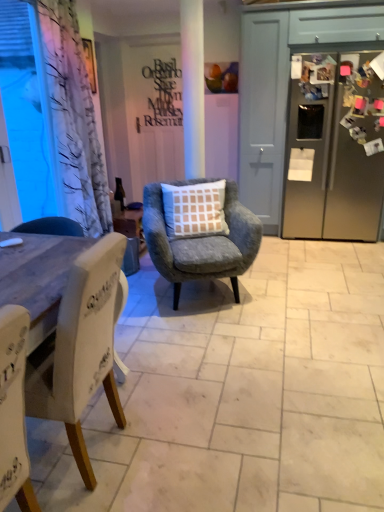
Image resolution: width=384 pixels, height=512 pixels. I want to click on white matte door at center, so click(263, 114).

Locate an element on the screen. The image size is (384, 512). satin silver refrigerator at right is located at coordinates (334, 148).

Describe the element at coordinates (80, 349) in the screenshot. I see `white fabric chair at left, which appears as the first chair when viewed from the left` at that location.

The width and height of the screenshot is (384, 512). Identify the location of matte black writing at center. 164,94.

Consider the image. Between white matte door at center and transparent plastic window screen at left, which one has larger size?

With larger size is white matte door at center.

Does white matte door at center have a lesser width compared to transparent plastic window screen at left?

No.

Can transparent plastic window screen at left be found inside white matte door at center?

Definitely not — transparent plastic window screen at left is not inside white matte door at center.

Is white matte door at center oriented away from transparent plastic window screen at left?

No, white matte door at center is not facing away from transparent plastic window screen at left.

In the scene shown: Is matte black writing at center turned away from satin silver refrigerator at right?

No, matte black writing at center's orientation is not away from satin silver refrigerator at right.

From a real-world perspective, is matte black writing at center positioned under satin silver refrigerator at right based on gravity?

No, from a real-world perspective, matte black writing at center is not below satin silver refrigerator at right.

From the image's perspective, does matte black writing at center appear lower than satin silver refrigerator at right?

No.

Which is less distant, (176, 106) or (345, 151)?

Point (176, 106).

In the scene shown: Relative to matte black writing at center, is matte black bottle at center in front or behind?

matte black bottle at center is in front of matte black writing at center.

Is there a large distance between matte black bottle at center and matte black writing at center?

Yes, matte black bottle at center and matte black writing at center are located far from each other.

This screenshot has width=384, height=512. Identify the location of writing behind the matte black bottle at center. (164, 94).

Which object is positioned more to the right, matte black bottle at center or matte black writing at center?

Positioned to the right is matte black writing at center.

Is matte black bottle at center looking in the opposite direction of transparent plastic window screen at left?

That's not correct — matte black bottle at center is not looking away from transparent plastic window screen at left.

The height and width of the screenshot is (512, 384). I want to click on bottle below the transparent plastic window screen at left (from a real-world perspective), so click(x=119, y=192).

From a real-world perspective, is matte black bottle at center located beneath transparent plastic window screen at left?

Yes, from a real-world perspective, matte black bottle at center is under transparent plastic window screen at left.

Between matte black bottle at center and transparent plastic window screen at left, which one appears on the right side from the viewer's perspective?

Positioned to the right is matte black bottle at center.

Consider the image. From a real-world perspective, relative to white fabric chair at left, which appears as the first chair when viewed from the left, is matte black bottle at center vertically above or below?

matte black bottle at center is above white fabric chair at left, which appears as the first chair when viewed from the left.

Is matte black bottle at center touching white fabric chair at left, the 2th chair positioned from the back?

They are not placed beside each other.

Is matte black bottle at center wider than white fabric chair at left, which appears as the first chair when viewed from the left?

No, matte black bottle at center is not wider than white fabric chair at left, which appears as the first chair when viewed from the left.

You are a GUI agent. You are given a task and a screenshot of the screen. Output one action in this format:
    pyautogui.click(x=<x>, y=<y>)
    Task: Click on the screen door located in front of the matte black bottle at center
    Image resolution: width=384 pixels, height=512 pixels.
    Given the screenshot: What is the action you would take?
    pyautogui.click(x=263, y=114)

Which of these two, white matte door at center or matte black bottle at center, is smaller?

With smaller size is matte black bottle at center.

Considering the positions of objects white matte door at center and matte black bottle at center in the image provided, who is behind, white matte door at center or matte black bottle at center?

Positioned behind is matte black bottle at center.

Which object is positioned more to the right, white matte door at center or matte black bottle at center?

Positioned to the right is white matte door at center.

Considering the positions of points (59, 344) and (24, 157), is point (59, 344) farther from camera compared to point (24, 157)?

No, (59, 344) is closer to viewer.

From a real-world perspective, is white fabric chair at left, which appears as the first chair when viewed from the left, positioned above or below transparent plastic window screen at left?

From a real-world perspective, white fabric chair at left, which appears as the first chair when viewed from the left, is physically below transparent plastic window screen at left.

What's the angular difference between white fabric chair at left, which appears as the first chair when viewed from the left, and transparent plastic window screen at left's facing directions?

179 degrees.

Considering the sizes of objects white fabric chair at left, which ranks as the second chair in right-to-left order, and transparent plastic window screen at left in the image provided, who is thinner, white fabric chair at left, which ranks as the second chair in right-to-left order, or transparent plastic window screen at left?

transparent plastic window screen at left is thinner.

Identify the location of window screen that appears above the white matte door at center (from a real-world perspective). (27, 117).

This screenshot has height=512, width=384. I want to click on writing that appears behind the satin silver refrigerator at right, so click(x=164, y=94).

Looking at the image, which one is located further to white matte door at center, matte black writing at center or satin silver refrigerator at right?

matte black writing at center lies further to white matte door at center than the other object.

Which object lies nearer to the anchor point velvet grey armchair with checkered cushion at center, which ranks as the 2th chair in front-to-back order, satin silver refrigerator at right or matte black writing at center?

satin silver refrigerator at right.

Which object lies nearer to the anchor point matte black writing at center, velvet grey armchair with checkered cushion at center, which ranks as the 2th chair in front-to-back order, or white matte door at center?

white matte door at center is closer to matte black writing at center.

Estimate the real-world distances between objects in this image. Which object is closer to white matte door at center, matte black bottle at center or transparent plastic window screen at left?

Based on the image, matte black bottle at center appears to be nearer to white matte door at center.

Based on their spatial positions, is velvet grey armchair with checkered cushion at center, the second chair in the left-to-right sequence, or matte black bottle at center closer to white matte door at center?

velvet grey armchair with checkered cushion at center, the second chair in the left-to-right sequence.

Which object lies nearer to the anchor point satin silver refrigerator at right, matte black writing at center or white matte door at center?

Among the two, white matte door at center is located nearer to satin silver refrigerator at right.

Which object lies nearer to the anchor point satin silver refrigerator at right, transparent plastic window screen at left or velvet grey armchair with checkered cushion at center, the second chair in the left-to-right sequence?

velvet grey armchair with checkered cushion at center, the second chair in the left-to-right sequence, lies closer to satin silver refrigerator at right than the other object.

Estimate the real-world distances between objects in this image. Which object is further from satin silver refrigerator at right, velvet grey armchair with checkered cushion at center, which ranks as the 2th chair in front-to-back order, or white matte door at center?

The object further to satin silver refrigerator at right is velvet grey armchair with checkered cushion at center, which ranks as the 2th chair in front-to-back order.

Locate an element on the screen. The width and height of the screenshot is (384, 512). chair located between white fabric chair at left, the 2th chair positioned from the back, and white matte door at center in the depth direction is located at coordinates (201, 243).

What are the coordinates of `window screen located between white fabric chair at left, positioned as the 1th chair in front-to-back order, and matte black bottle at center in the depth direction` in the screenshot? It's located at (27, 117).

Where is `screen door between velvet grey armchair with checkered cushion at center, the 1th chair when ordered from back to front, and matte black writing at center, along the z-axis`? The image size is (384, 512). screen door between velvet grey armchair with checkered cushion at center, the 1th chair when ordered from back to front, and matte black writing at center, along the z-axis is located at coordinates (263, 114).

At what (x,y) coordinates should I click in order to perform the action: click on chair located between transparent plastic window screen at left and matte black writing at center in the depth direction. Please return your answer as a coordinate pair (x, y). The height and width of the screenshot is (512, 384). Looking at the image, I should click on tap(201, 243).